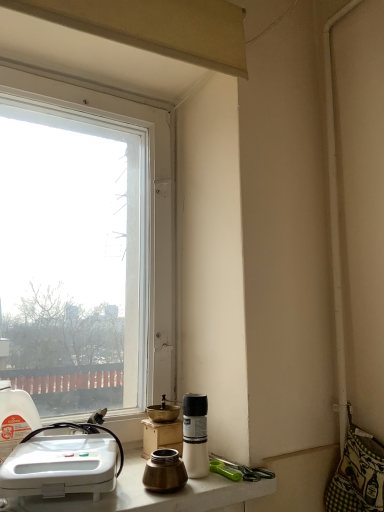
Identify the location of free location to the left of white matte bottle at lower center, the 1th bottle positioned from the right. The width and height of the screenshot is (384, 512). (123, 483).